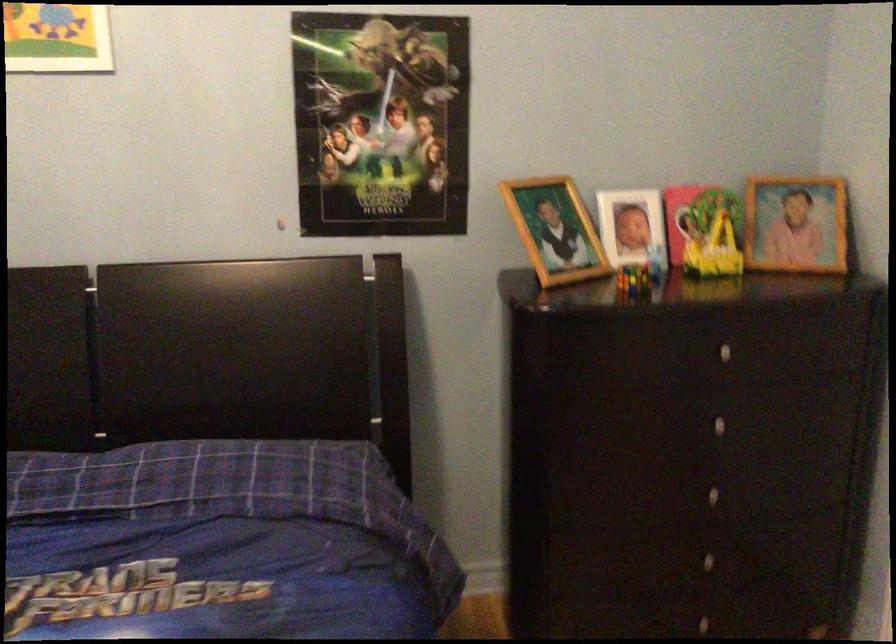
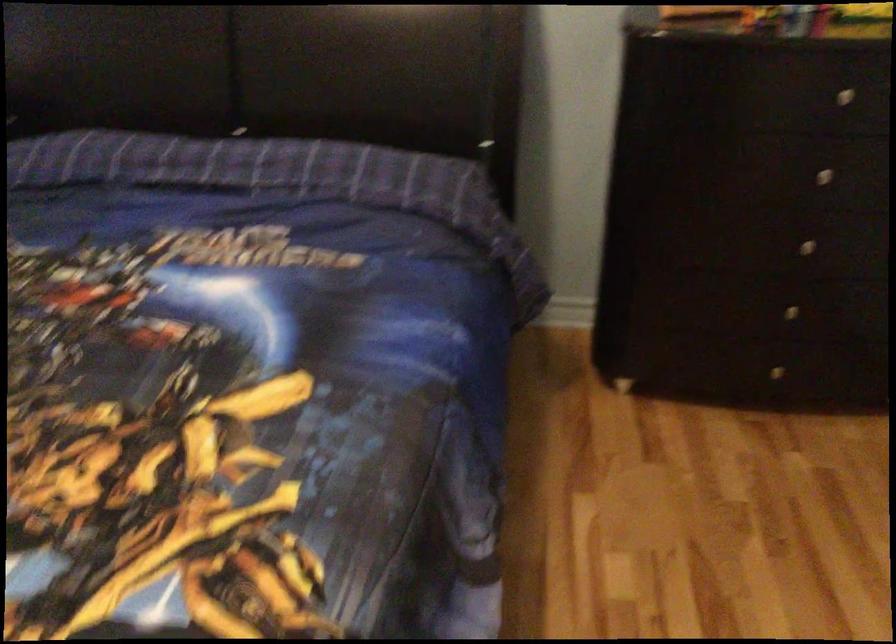
The point at (728, 415) is marked in the first image. Where is the corresponding point in the second image?

(833, 169)